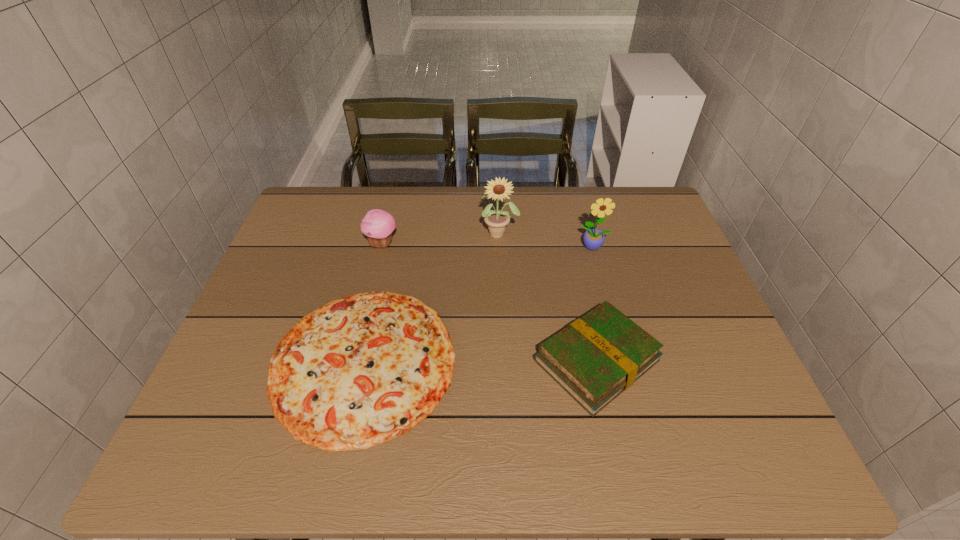
Where is `free space located on the back of the book`? free space located on the back of the book is located at coordinates (567, 228).

Find the location of a particular element. This screenshot has height=540, width=960. vacant space located on the back of the pizza is located at coordinates (383, 278).

What are the coordinates of `object that is at the far edge` in the screenshot? It's located at (496, 220).

Locate an element on the screen. object located at the near edge is located at coordinates pos(362,370).

Where is `object that is at the left edge`? object that is at the left edge is located at coordinates (362, 370).

Find the location of a particular element. object that is at the near left corner is located at coordinates (362, 370).

Where is `blank area at the far edge`? The height and width of the screenshot is (540, 960). blank area at the far edge is located at coordinates (477, 191).

Find the location of a particular element. The width and height of the screenshot is (960, 540). free space at the near edge of the desktop is located at coordinates pos(413,464).

The height and width of the screenshot is (540, 960). Identify the location of vacant space at the left edge. (247, 379).

This screenshot has width=960, height=540. I want to click on vacant space at the right edge of the desktop, so click(x=648, y=240).